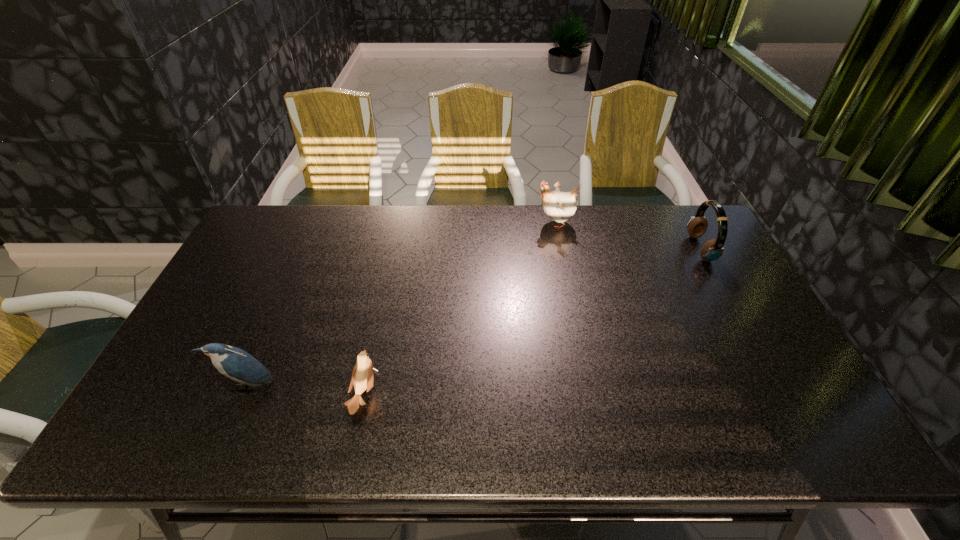
You are a GUI agent. You are given a task and a screenshot of the screen. Output one action in this format:
    pyautogui.click(x=<x>, y=<y>)
    Task: Click on the free spot that satisfies the following two spatial constraints: 1. on the ear cup of the rightmost object; 2. at the tip of the leftmost object's beak
    
    Given the screenshot: What is the action you would take?
    pyautogui.click(x=776, y=386)